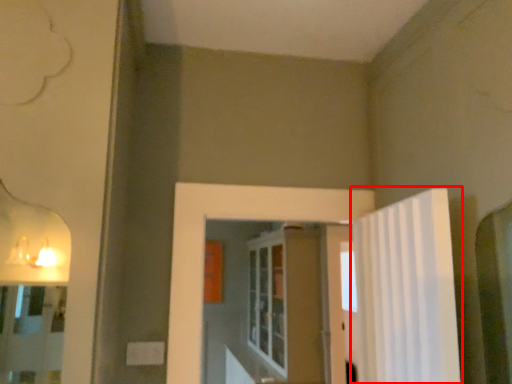
Question: Considering the relative positions of shower curtain (annotated by the red box) and screen door in the image provided, where is shower curtain (annotated by the red box) located with respect to the staircase?

Choices:
 (A) left
 (B) right

Answer: (B)